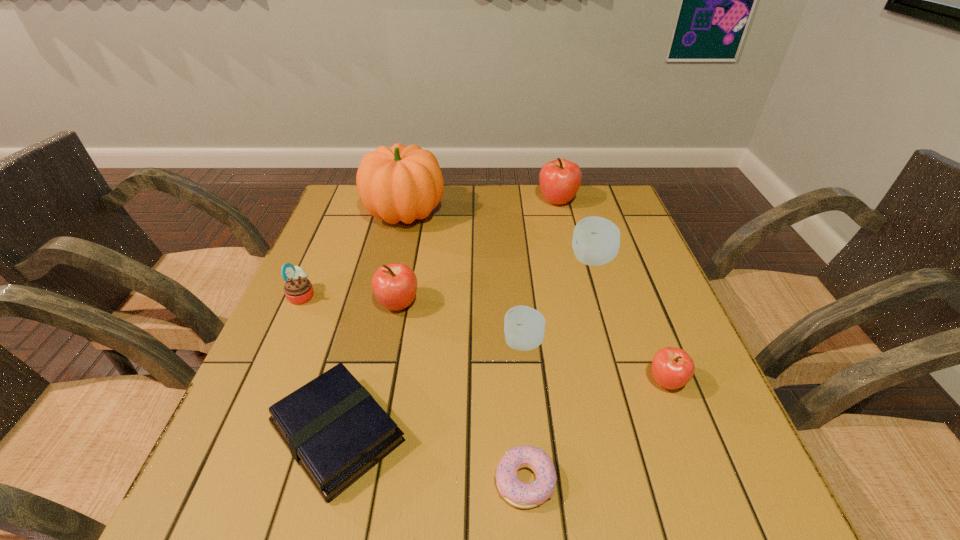
I want to click on unoccupied position between the second farthest apple and the second biggest pink apple, so click(x=495, y=282).

Identify the location of unoccupied area between the book and the nearest pink apple. (502, 407).

At what (x,y) coordinates should I click in order to perform the action: click on object that is the fifth nearest to the pink doughnut. Please return your answer as a coordinate pair (x, y). Image resolution: width=960 pixels, height=540 pixels. Looking at the image, I should click on (596, 240).

Locate which object is the second closest to the rightmost pink apple. Please provide its 2D coordinates. Your answer should be formatted as a tuple, i.e. [(x, y)], where the tuple contains the x and y coordinates of a point satisfying the conditions above.

[(523, 495)]

Choose which apple is the fourth nearest neighbor to the farther white apple. Please provide its 2D coordinates. Your answer should be formatted as a tuple, i.e. [(x, y)], where the tuple contains the x and y coordinates of a point satisfying the conditions above.

[(394, 285)]

Locate an element on the screen. This screenshot has width=960, height=540. the fourth closest apple to the rightmost pink apple is located at coordinates (560, 179).

Select which pink apple appears as the closest to the pink doughnut. Please provide its 2D coordinates. Your answer should be formatted as a tuple, i.e. [(x, y)], where the tuple contains the x and y coordinates of a point satisfying the conditions above.

[(672, 368)]

Identify which pink apple is located as the second nearest to the third farthest apple. Please provide its 2D coordinates. Your answer should be formatted as a tuple, i.e. [(x, y)], where the tuple contains the x and y coordinates of a point satisfying the conditions above.

[(672, 368)]

In order to click on vacant space that satisfies the following two spatial constraints: 1. on the front-facing side of the leftmost pink apple; 2. on the left side of the muffin in this screenshot , I will do `click(299, 305)`.

At what (x,y) coordinates should I click in order to perform the action: click on free spot that satisfies the following two spatial constraints: 1. on the front side of the second pink apple from left to right; 2. on the front-facing side of the muffin. Please return your answer as a coordinate pair (x, y). The width and height of the screenshot is (960, 540). Looking at the image, I should click on (581, 296).